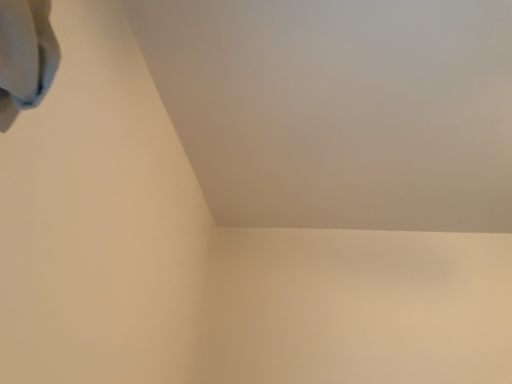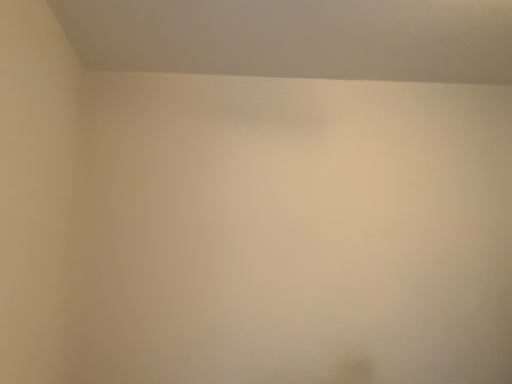
Question: Which way did the camera rotate in the video?

Choices:
 (A) rotated right
 (B) rotated left

Answer: (A)